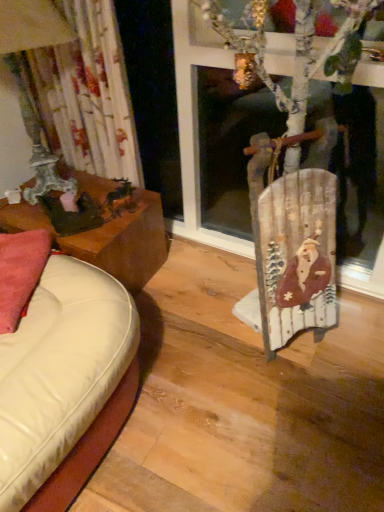
Question: From the image's perspective, is brown wooden table at left on top of floral fabric curtain at left?

Choices:
 (A) yes
 (B) no

Answer: (B)

Question: Can you confirm if brown wooden table at left is bigger than floral fabric curtain at left?

Choices:
 (A) yes
 (B) no

Answer: (A)

Question: Could you tell me if brown wooden table at left is turned towards floral fabric curtain at left?

Choices:
 (A) yes
 (B) no

Answer: (B)

Question: Is brown wooden table at left shorter than floral fabric curtain at left?

Choices:
 (A) no
 (B) yes

Answer: (B)

Question: Can you confirm if brown wooden table at left is thinner than floral fabric curtain at left?

Choices:
 (A) yes
 (B) no

Answer: (B)

Question: Can you confirm if brown wooden table at left is taller than floral fabric curtain at left?

Choices:
 (A) yes
 (B) no

Answer: (B)

Question: From the image's perspective, is floral fabric curtain at left over pink fabric pillow at left?

Choices:
 (A) no
 (B) yes

Answer: (B)

Question: From a real-world perspective, is floral fabric curtain at left physically above pink fabric pillow at left?

Choices:
 (A) no
 (B) yes

Answer: (B)

Question: Is floral fabric curtain at left outside of pink fabric pillow at left?

Choices:
 (A) no
 (B) yes

Answer: (B)

Question: Considering the relative sizes of floral fabric curtain at left and pink fabric pillow at left in the image provided, is floral fabric curtain at left shorter than pink fabric pillow at left?

Choices:
 (A) no
 (B) yes

Answer: (A)

Question: Is floral fabric curtain at left at the right side of pink fabric pillow at left?

Choices:
 (A) yes
 (B) no

Answer: (B)

Question: Does floral fabric curtain at left have a greater width compared to pink fabric pillow at left?

Choices:
 (A) yes
 (B) no

Answer: (A)

Question: Can you confirm if wooden sled at right is thinner than floral fabric curtain at left?

Choices:
 (A) no
 (B) yes

Answer: (B)